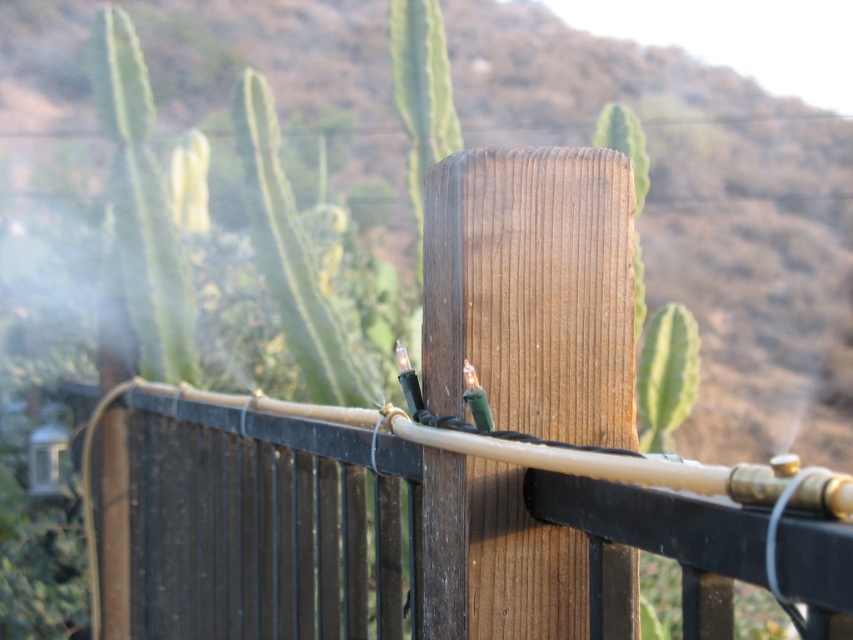
Between point (407, 204) and point (260, 609), which one is positioned behind?

The point (407, 204) is more distant.

Does point (743, 294) come behind point (148, 499)?

Yes, it is.

Is point (756, 248) positioned before point (189, 449)?

No, it is behind (189, 449).

Find the location of `brown wooden post at center`. brown wooden post at center is located at coordinates (697, 211).